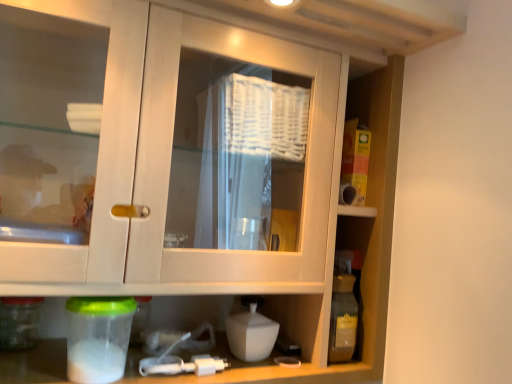
Locate an element on the screen. The width and height of the screenshot is (512, 384). translucent plastic container at lower left is located at coordinates (98, 338).

In the scene shown: In order to face translucent plastic container at lower left, should I rotate leftwards or rightwards?

You should look left and rotate roughly 19.584 degrees.

What do you see at coordinates (98, 338) in the screenshot? I see `translucent plastic container at lower left` at bounding box center [98, 338].

Where is `translucent plastic container at lower left`? translucent plastic container at lower left is located at coordinates click(98, 338).